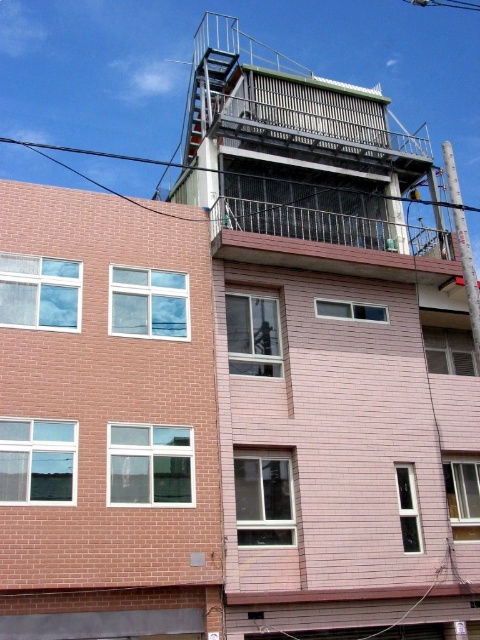
Between brown textured balcony at upper center and black wire at upper left, which one appears on the right side from the viewer's perspective?

black wire at upper left

Find the location of a particular element. This screenshot has width=480, height=640. brown textured balcony at upper center is located at coordinates (328, 241).

Where is `brown textured balcony at upper center`? The image size is (480, 640). brown textured balcony at upper center is located at coordinates (328, 241).